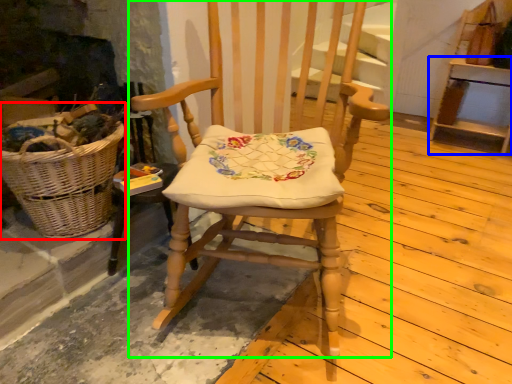
Question: Considering the real-world distances, which object is farthest from picnic basket (highlighted by a red box)? furniture (highlighted by a blue box) or chair (highlighted by a green box)?

Choices:
 (A) furniture
 (B) chair

Answer: (A)